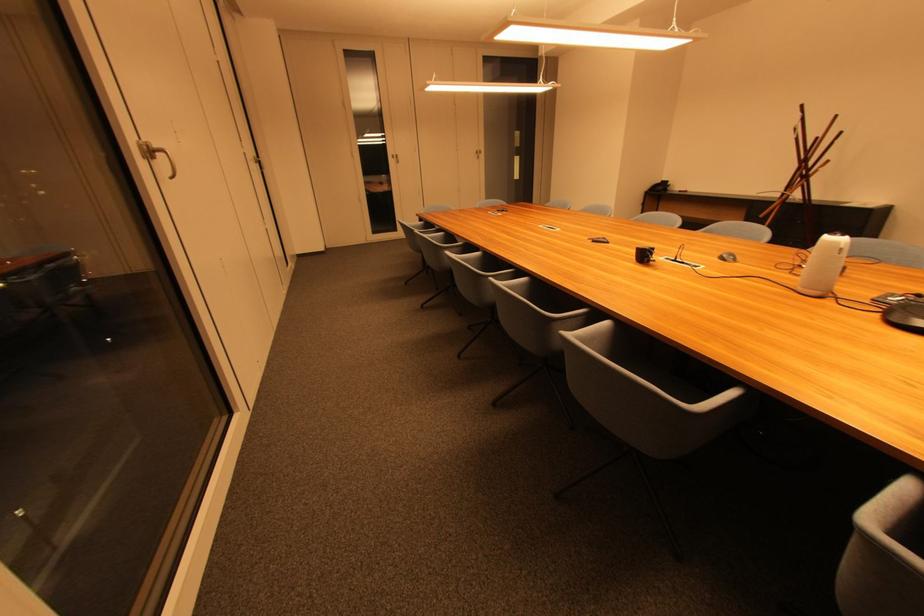
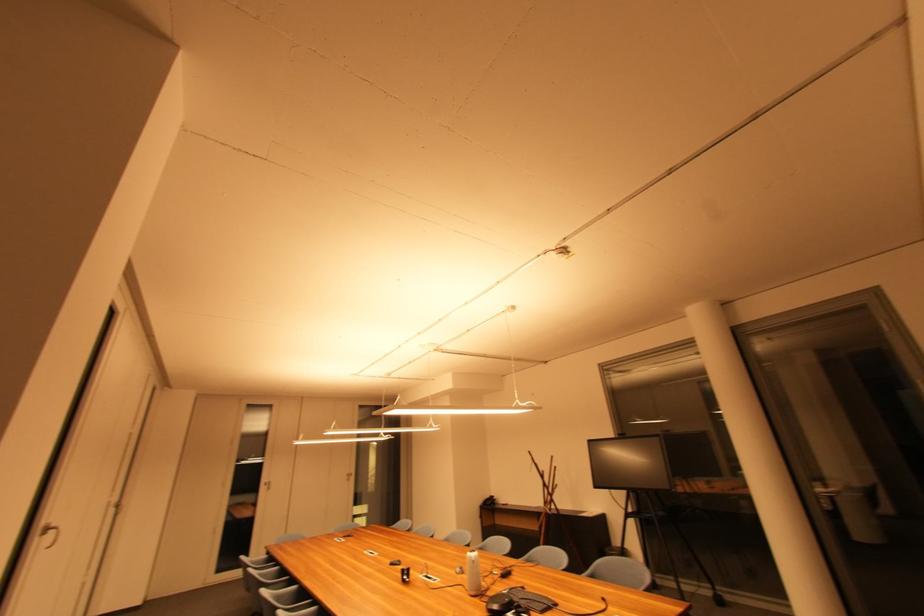
Where in the second image is the point corresponding to (841,245) from the first image?

(477, 560)